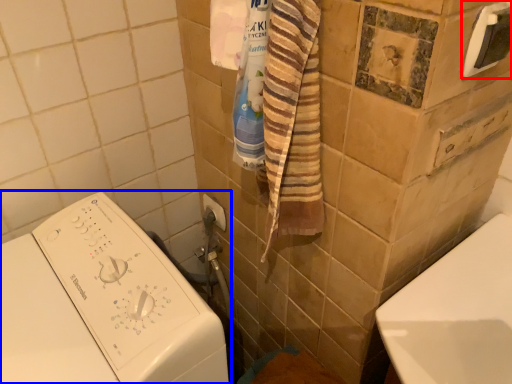
Question: Which object is closer to the camera taking this photo, towel bar (highlighted by a red box) or washing machine (highlighted by a blue box)?

Choices:
 (A) towel bar
 (B) washing machine

Answer: (B)